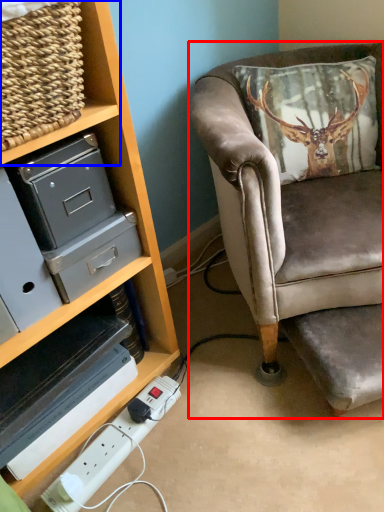
Question: Which object appears closest to the camera in this image, chair (highlighted by a red box) or shelf (highlighted by a blue box)?

Choices:
 (A) chair
 (B) shelf

Answer: (B)